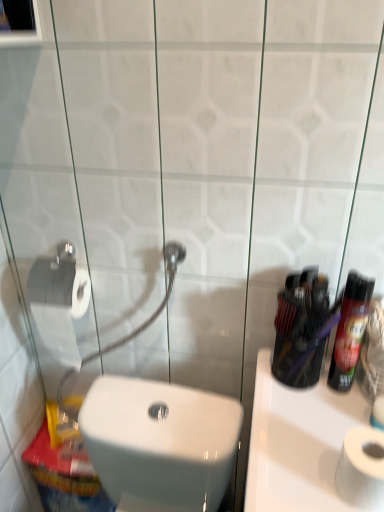
Question: Can you confirm if shiny black spray can at right is bigger than white glossy toilet at lower left?

Choices:
 (A) no
 (B) yes

Answer: (A)

Question: From a real-world perspective, is shiny black spray can at right under white glossy toilet at lower left?

Choices:
 (A) no
 (B) yes

Answer: (A)

Question: Considering the relative sizes of shiny black spray can at right and white glossy toilet at lower left in the image provided, is shiny black spray can at right thinner than white glossy toilet at lower left?

Choices:
 (A) yes
 (B) no

Answer: (A)

Question: Is shiny black spray can at right next to white glossy toilet at lower left and touching it?

Choices:
 (A) no
 (B) yes

Answer: (A)

Question: From the image's perspective, does shiny black spray can at right appear higher than white glossy toilet at lower left?

Choices:
 (A) yes
 (B) no

Answer: (A)

Question: Is point (354, 403) positioned closer to the camera than point (284, 361)?

Choices:
 (A) closer
 (B) farther

Answer: (A)

Question: Based on their positions, is white glossy sink at right located to the left or right of translucent plastic mouthwash at center?

Choices:
 (A) left
 (B) right

Answer: (B)

Question: Is white glossy sink at right inside or outside of translucent plastic mouthwash at center?

Choices:
 (A) outside
 (B) inside

Answer: (A)

Question: From a real-world perspective, is white glossy sink at right physically located above or below translucent plastic mouthwash at center?

Choices:
 (A) below
 (B) above

Answer: (A)

Question: Relative to white glossy sink at right, is translucent plastic mouthwash at center in front or behind?

Choices:
 (A) behind
 (B) front

Answer: (A)

Question: From a real-world perspective, relative to white glossy sink at right, is translucent plastic mouthwash at center vertically above or below?

Choices:
 (A) below
 (B) above

Answer: (B)

Question: From their relative heights in the image, would you say translucent plastic mouthwash at center is taller or shorter than white glossy sink at right?

Choices:
 (A) tall
 (B) short

Answer: (B)

Question: Considering the relative positions of translucent plastic mouthwash at center and white glossy sink at right in the image provided, is translucent plastic mouthwash at center to the left or to the right of white glossy sink at right?

Choices:
 (A) right
 (B) left

Answer: (B)

Question: Considering the positions of shiny black spray can at right and white matte toilet paper at lower right in the image, is shiny black spray can at right wider or thinner than white matte toilet paper at lower right?

Choices:
 (A) thin
 (B) wide

Answer: (A)

Question: In terms of height, does shiny black spray can at right look taller or shorter compared to white matte toilet paper at lower right?

Choices:
 (A) tall
 (B) short

Answer: (A)